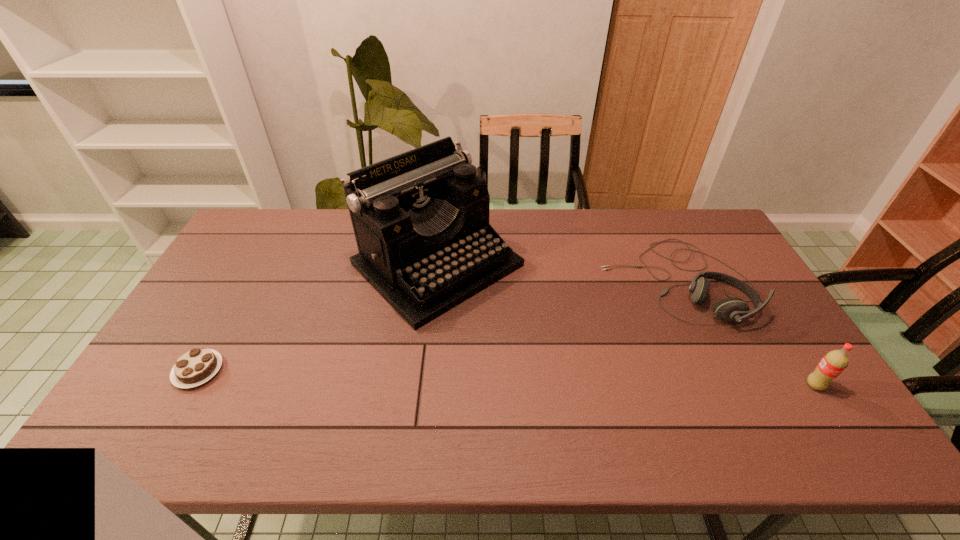
Find the location of a particular element. The width and height of the screenshot is (960, 540). the third closest object to the third shortest object is located at coordinates pos(197,366).